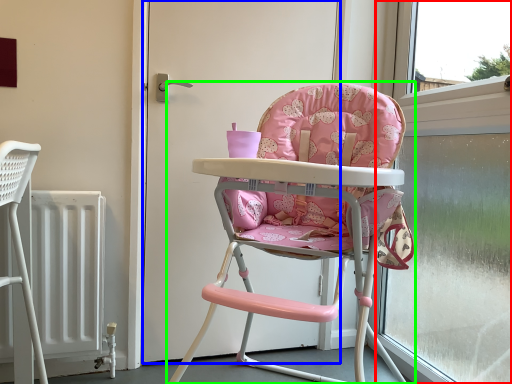
Question: Which is farther away from window frame (highlighted by a red box)? door (highlighted by a blue box) or chair (highlighted by a green box)?

Choices:
 (A) door
 (B) chair

Answer: (A)